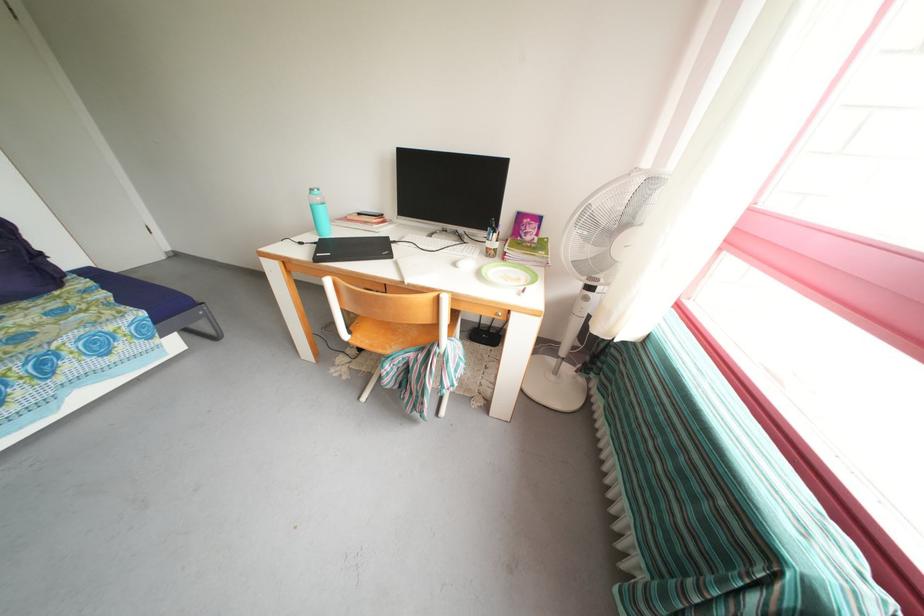
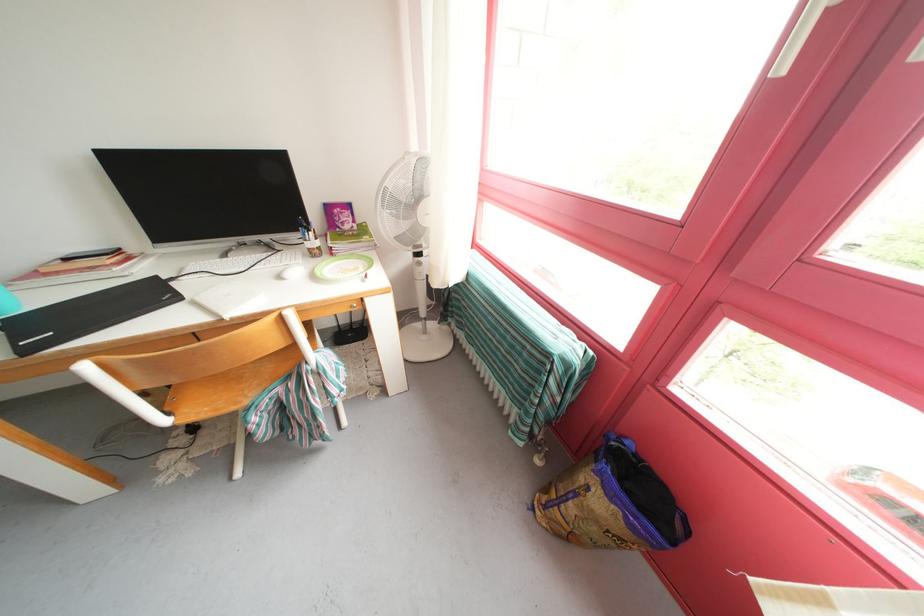
In the second image, find the point that corresponds to (x=593, y=305) in the first image.

(427, 270)